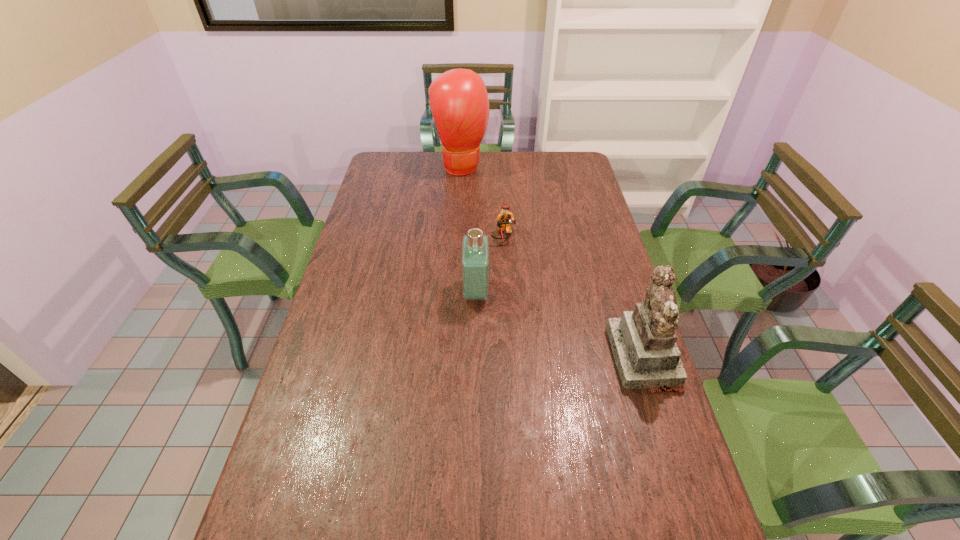
This screenshot has width=960, height=540. Find the location of `free space on the desktop that is between the perfume and the figurine and is positioned on the striking surface of the farthest object`. free space on the desktop that is between the perfume and the figurine and is positioned on the striking surface of the farthest object is located at coordinates (556, 323).

Find the location of a particular element. Image resolution: width=960 pixels, height=540 pixels. free space on the desktop that is between the third tallest object and the third shortest object and is positioned holding a crossbow in the hands of the third nearest object is located at coordinates (537, 316).